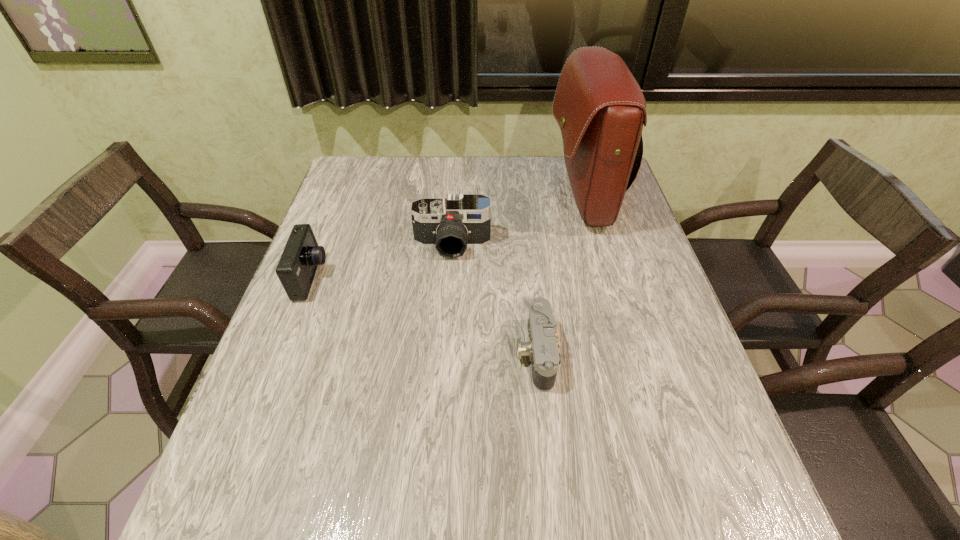
Where is `the tallest object`? the tallest object is located at coordinates (599, 106).

The height and width of the screenshot is (540, 960). I want to click on satchel, so click(599, 106).

Where is `the second camera from right to left`? The image size is (960, 540). the second camera from right to left is located at coordinates [x=450, y=224].

At what (x,y) coordinates should I click in order to perform the action: click on the leftmost camera. Please return your answer as a coordinate pair (x, y). Image resolution: width=960 pixels, height=540 pixels. Looking at the image, I should click on (296, 269).

Where is `the rightmost camera`? the rightmost camera is located at coordinates (542, 347).

The width and height of the screenshot is (960, 540). I want to click on the shortest camera, so click(542, 347).

What are the coordinates of `vacant space located on the open flap of the tallest object` in the screenshot? It's located at (467, 197).

Identify the location of free space located on the open flap of the tallest object. The image size is (960, 540). (427, 197).

You are a GUI agent. You are given a task and a screenshot of the screen. Output one action in this format:
    pyautogui.click(x=<x>, y=<y>)
    Task: Click on the blank area located 0.070m on the open flap of the tallest object
    The image size is (960, 540).
    Given the screenshot: What is the action you would take?
    pyautogui.click(x=526, y=197)

Where is `vacant space located 0.110m on the front-facing side of the third object from right to left`? vacant space located 0.110m on the front-facing side of the third object from right to left is located at coordinates (449, 292).